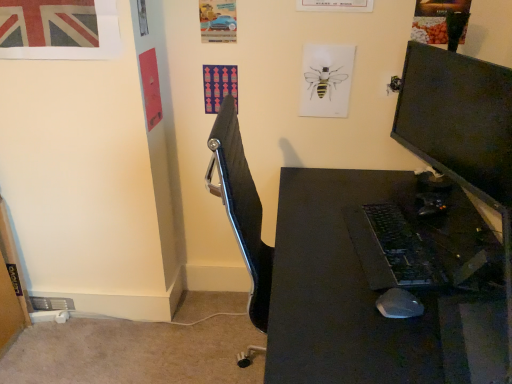
Identify the location of vacant space to the right of black plastic keyboard at center-right. (455, 247).